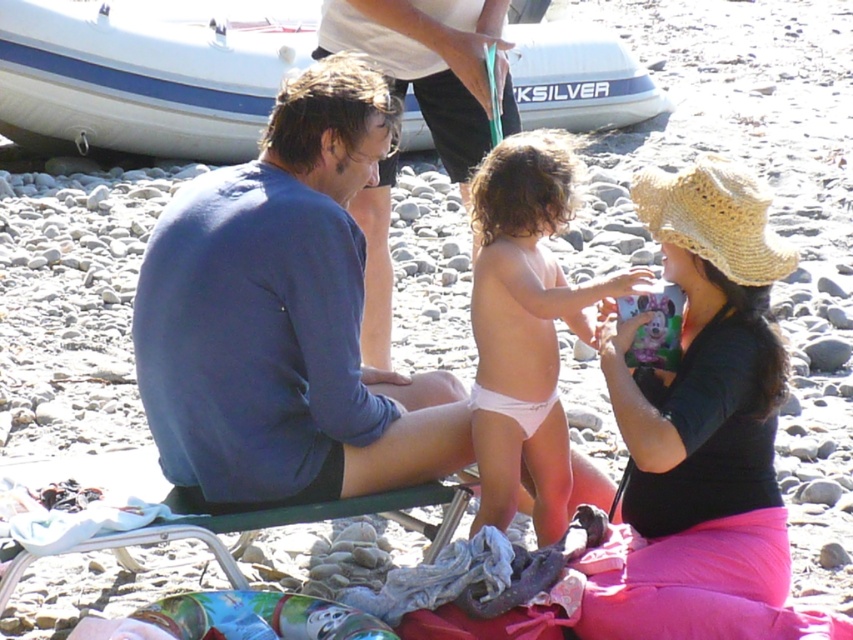
Is straw hat at center positioned behind blue cotton shirt at center?

No.

Where is `straw hat at center`? The height and width of the screenshot is (640, 853). straw hat at center is located at coordinates (701, 424).

From the picture: Can you confirm if straw hat at center is positioned to the right of white rubber boat at upper center?

Yes, straw hat at center is to the right of white rubber boat at upper center.

Does straw hat at center come in front of white rubber boat at upper center?

Yes, it is in front of white rubber boat at upper center.

Does point (682, 564) lie behind point (624, 83)?

No, (682, 564) is closer to viewer.

Locate an element on the screen. This screenshot has width=853, height=640. straw hat at center is located at coordinates (701, 424).

Is white rubber boat at upper center bigger than blue cotton shirt at center?

Incorrect, white rubber boat at upper center is not larger than blue cotton shirt at center.

Who is more distant from viewer, (183, 4) or (434, 33)?

Point (183, 4)

Find the location of a particular element. Image resolution: width=853 pixels, height=640 pixels. white rubber boat at upper center is located at coordinates tap(143, 76).